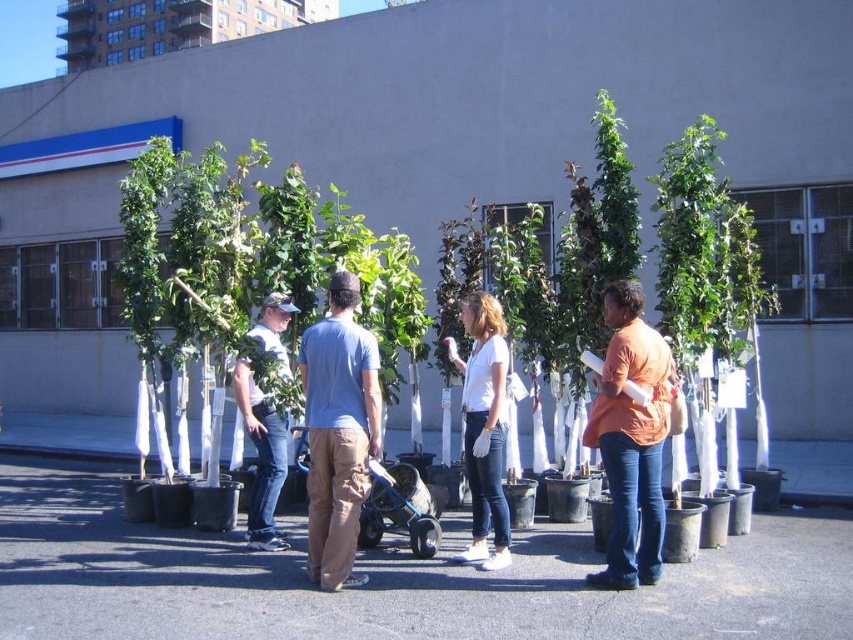
Question: Which object is positioned farthest from the white matte shirt at center?

Choices:
 (A) blue cotton shirt at center
 (B) orange cotton shirt at center

Answer: (A)

Question: Can you confirm if blue cotton shirt at center is positioned to the left of white cotton shirt at center?

Choices:
 (A) yes
 (B) no

Answer: (B)

Question: Which of the following is the closest to the observer?

Choices:
 (A) white matte shirt at center
 (B) orange cotton shirt at center

Answer: (B)

Question: Considering the relative positions of blue cotton shirt at center and orange cotton shirt at center in the image provided, where is blue cotton shirt at center located with respect to orange cotton shirt at center?

Choices:
 (A) above
 (B) below

Answer: (A)

Question: Which is farther from the blue cotton shirt at center?

Choices:
 (A) white matte shirt at center
 (B) orange cotton shirt at center
 (C) white cotton shirt at center

Answer: (B)

Question: Is blue cotton shirt at center smaller than orange cotton shirt at center?

Choices:
 (A) yes
 (B) no

Answer: (A)